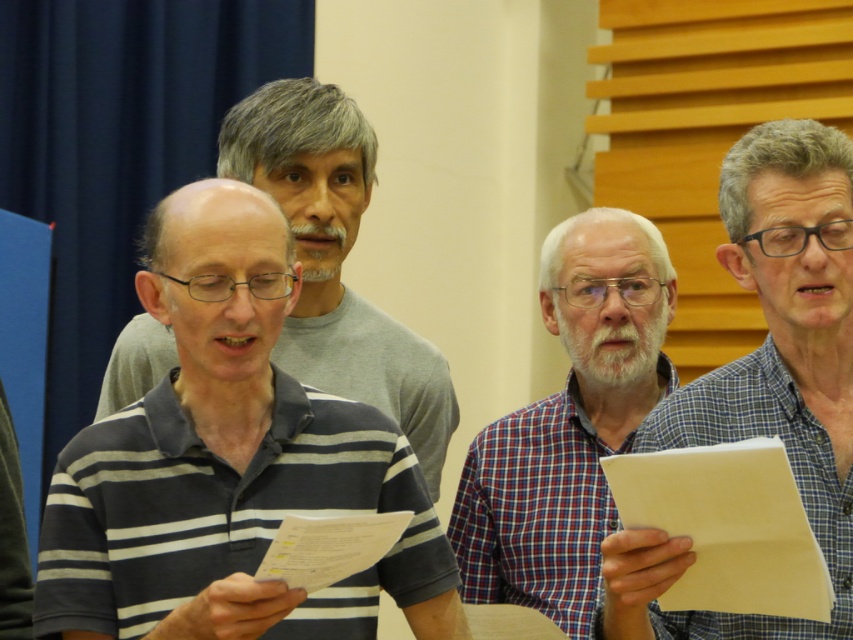
You are organizing a meeting and need to distribute handouts. You have a yellow paper at lower right and a white paper at lower center. Which paper should you choose if you want to provide a larger handout?

The yellow paper at lower right should be chosen as it has a larger size compared to the white paper at lower center.

You are an observer in the room. You see the plaid fabric shirt at center and the striped cotton shirt at center. Which one is positioned lower in the image?

The plaid fabric shirt at center is below the striped cotton shirt at center, so the plaid fabric shirt at center is positioned lower in the image.